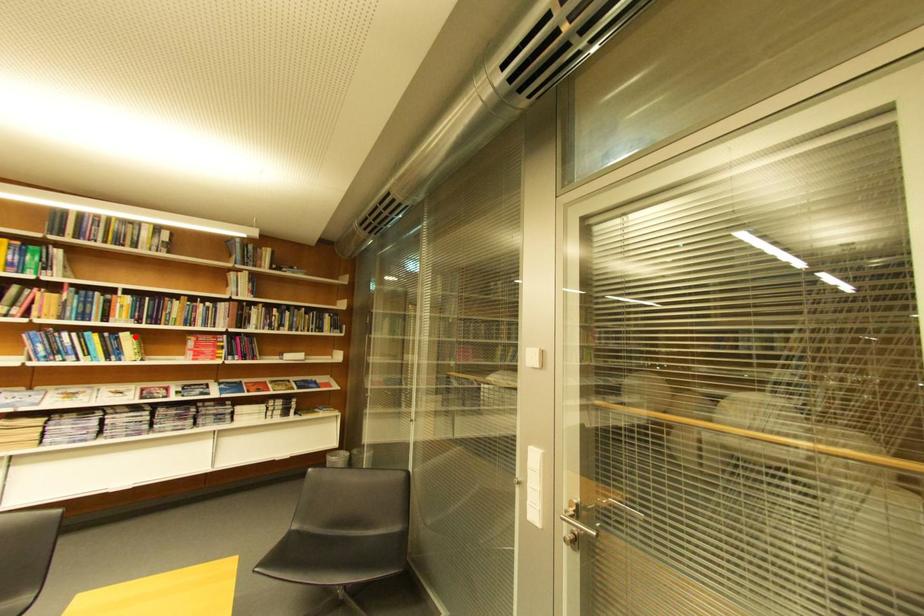
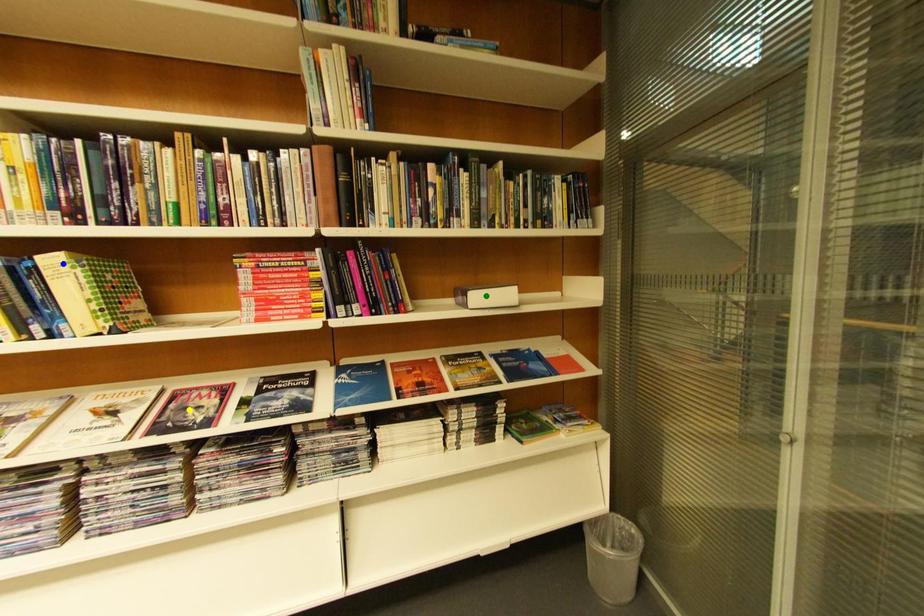
Question: I am providing you with two images of the same scene from different viewpoints. A red point is marked on the first image. You are given multiple points on the second image. Which mark in image 2 goes with the point in image 1?

Choices:
 (A) green point
 (B) yellow point
 (C) blue point

Answer: (C)